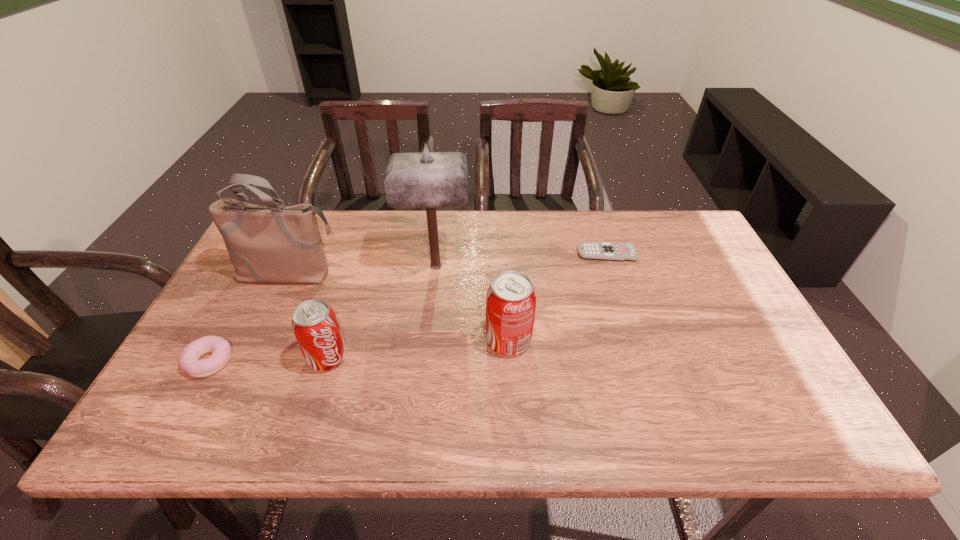
Locate an element on the screen. The width and height of the screenshot is (960, 540). vacant space located 0.240m on the back of the right soda is located at coordinates (504, 263).

The height and width of the screenshot is (540, 960). Find the location of `vacant position located on the front-facing side of the second tallest object`. vacant position located on the front-facing side of the second tallest object is located at coordinates (231, 400).

Where is `free location located on the front of the mallet`? This screenshot has height=540, width=960. free location located on the front of the mallet is located at coordinates (421, 398).

Find the location of a particular element. This screenshot has height=540, width=960. free space located on the right of the rightmost object is located at coordinates (691, 254).

Locate an element on the screen. vacant area located 0.090m on the right of the fifth tallest object is located at coordinates (271, 361).

Locate an element on the screen. This screenshot has width=960, height=540. mallet that is at the far edge is located at coordinates (430, 180).

Find the location of a particular element. remote control that is at the far edge is located at coordinates (613, 251).

This screenshot has height=540, width=960. In order to click on soda at the near edge in this screenshot , I will do `click(315, 325)`.

You are a GUI agent. You are given a task and a screenshot of the screen. Output one action in this format:
    pyautogui.click(x=<x>, y=<y>)
    Task: Click on the doughnut at the near edge
    Image resolution: width=960 pixels, height=540 pixels.
    Given the screenshot: What is the action you would take?
    pyautogui.click(x=189, y=360)

In order to click on shoulder bag at the left edge in this screenshot , I will do point(275,243).